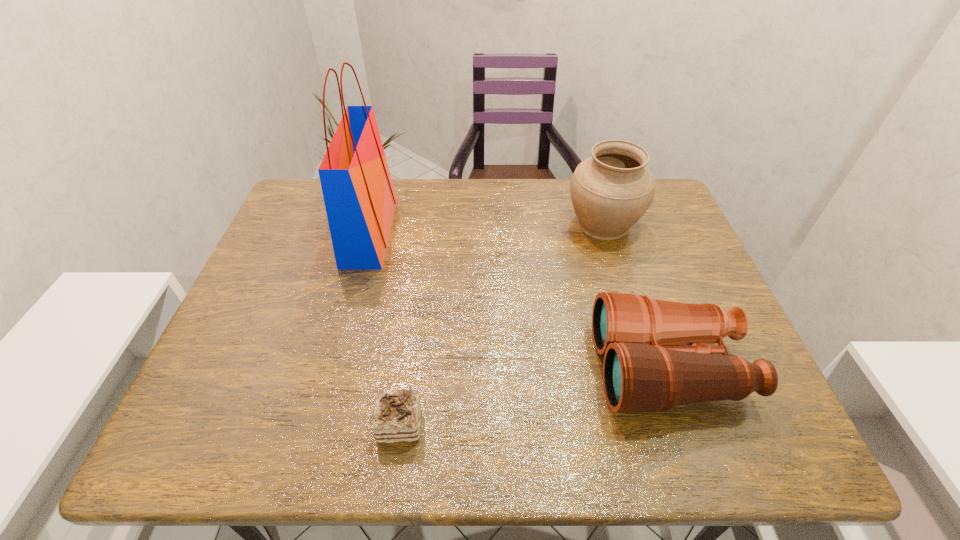
You are a GUI agent. You are given a task and a screenshot of the screen. Output one action in this format:
    pyautogui.click(x=<x>, y=<y>)
    Task: Click on the free space at the far edge
    The height and width of the screenshot is (540, 960).
    Given the screenshot: What is the action you would take?
    pyautogui.click(x=473, y=194)

You are a GUI agent. You are given a task and a screenshot of the screen. Output one action in this format:
    pyautogui.click(x=<x>, y=<y>)
    Task: Click on the blank space at the near edge of the desktop
    The image size is (960, 540).
    Given the screenshot: What is the action you would take?
    pyautogui.click(x=408, y=457)

At what (x,y) coordinates should I click in order to perform the action: click on vacant space at the left edge of the desktop. Please return your answer as a coordinate pair (x, y). Looking at the image, I should click on (288, 307).

Where is `vacant space at the far left corner of the desktop`? Image resolution: width=960 pixels, height=540 pixels. vacant space at the far left corner of the desktop is located at coordinates (311, 178).

The image size is (960, 540). Identify the location of free space at the near left corner of the desktop. (241, 441).

This screenshot has height=540, width=960. Find the location of `unoccupied area between the binoculars and the chocolate cake`. unoccupied area between the binoculars and the chocolate cake is located at coordinates (534, 396).

The width and height of the screenshot is (960, 540). Find the location of `free space that is in between the third shortest object and the shortest object`. free space that is in between the third shortest object and the shortest object is located at coordinates (501, 324).

Identify the location of vacant point located between the tallest object and the second tallest object. The width and height of the screenshot is (960, 540). (487, 228).

The image size is (960, 540). I want to click on empty space that is in between the shopping bag and the third shortest object, so click(487, 228).

Identify the location of vacant area that lies between the leftmost object and the urn. (487, 228).